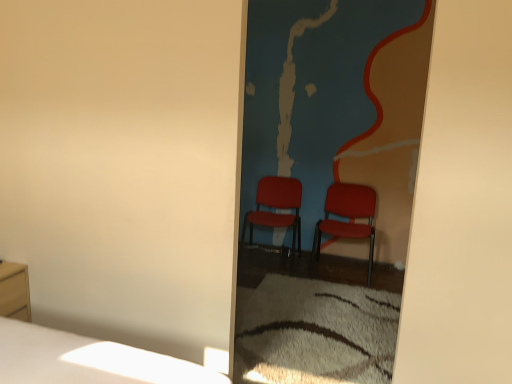
Question: Considering the relative sizes of matte red chairs at center and matte wood nightstand at lower left in the image provided, is matte red chairs at center thinner than matte wood nightstand at lower left?

Choices:
 (A) yes
 (B) no

Answer: (A)

Question: Is matte red chairs at center to the right of matte wood nightstand at lower left from the viewer's perspective?

Choices:
 (A) no
 (B) yes

Answer: (B)

Question: Can you confirm if matte red chairs at center is bigger than matte wood nightstand at lower left?

Choices:
 (A) no
 (B) yes

Answer: (B)

Question: Can you confirm if matte red chairs at center is taller than matte wood nightstand at lower left?

Choices:
 (A) no
 (B) yes

Answer: (B)

Question: Can you confirm if matte red chairs at center is smaller than matte wood nightstand at lower left?

Choices:
 (A) no
 (B) yes

Answer: (A)

Question: From a real-world perspective, is matte red chairs at center physically located above or below matte wood nightstand at lower left?

Choices:
 (A) below
 (B) above

Answer: (B)

Question: Is matte red chairs at center bigger or smaller than matte wood nightstand at lower left?

Choices:
 (A) small
 (B) big

Answer: (B)

Question: From the image's perspective, relative to matte wood nightstand at lower left, is matte red chairs at center above or below?

Choices:
 (A) below
 (B) above

Answer: (B)

Question: Is point (318, 170) closer or farther from the camera than point (7, 306)?

Choices:
 (A) farther
 (B) closer

Answer: (A)

Question: From a real-world perspective, relative to matte red chair at center, the 1th chair from the left, is matte wood nightstand at lower left vertically above or below?

Choices:
 (A) below
 (B) above

Answer: (A)

Question: Is matte wood nightstand at lower left in front of or behind matte red chair at center, the second chair from the right, in the image?

Choices:
 (A) behind
 (B) front

Answer: (B)

Question: Does point (17, 301) appear closer or farther from the camera than point (267, 192)?

Choices:
 (A) farther
 (B) closer

Answer: (B)

Question: Is matte wood nightstand at lower left taller or shorter than matte red chair at center, the second chair from the right?

Choices:
 (A) tall
 (B) short

Answer: (B)

Question: From the image's perspective, is matte red chair at center, the second chair from the right, above or below matte red chairs at center?

Choices:
 (A) above
 (B) below

Answer: (B)

Question: Is matte red chair at center, the second chair from the right, spatially inside matte red chairs at center, or outside of it?

Choices:
 (A) inside
 (B) outside

Answer: (B)